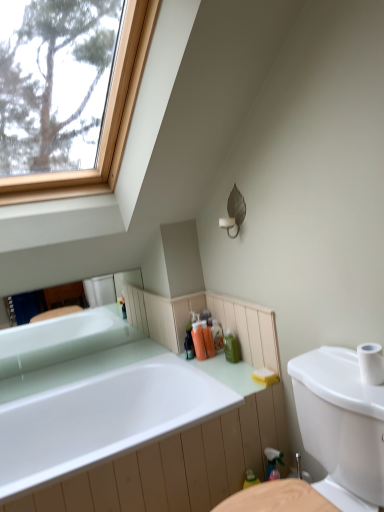
Question: Is white glossy bathtub at upper left, placed as the first bathtub when sorted from top to bottom, in front of white glossy sink at center?

Choices:
 (A) yes
 (B) no

Answer: (B)

Question: Is white glossy bathtub at upper left, which appears as the second bathtub when ordered from the bottom, smaller than white glossy sink at center?

Choices:
 (A) no
 (B) yes

Answer: (B)

Question: Does white glossy bathtub at upper left, which appears as the second bathtub when ordered from the bottom, have a greater height compared to white glossy sink at center?

Choices:
 (A) no
 (B) yes

Answer: (A)

Question: Considering the relative sizes of white glossy bathtub at upper left, which appears as the second bathtub when ordered from the bottom, and white glossy sink at center in the image provided, is white glossy bathtub at upper left, which appears as the second bathtub when ordered from the bottom, bigger than white glossy sink at center?

Choices:
 (A) yes
 (B) no

Answer: (B)

Question: From a real-world perspective, is white glossy bathtub at upper left, placed as the first bathtub when sorted from top to bottom, under white glossy sink at center?

Choices:
 (A) no
 (B) yes

Answer: (A)

Question: Is white glossy sink at center completely or partially inside white glossy bathtub at upper left, which appears as the second bathtub when ordered from the bottom?

Choices:
 (A) yes
 (B) no

Answer: (B)

Question: From the image's perspective, would you say white glossy sink at center is shown under translucent orange soap at center, arranged as the second toiletry when viewed from the left?

Choices:
 (A) no
 (B) yes

Answer: (B)

Question: Is white glossy sink at center shorter than translucent orange soap at center, positioned as the 3th toiletry in right-to-left order?

Choices:
 (A) no
 (B) yes

Answer: (A)

Question: Can you confirm if white glossy sink at center is wider than translucent orange soap at center, arranged as the second toiletry when viewed from the left?

Choices:
 (A) yes
 (B) no

Answer: (A)

Question: Is translucent orange soap at center, positioned as the 3th toiletry in right-to-left order, completely or partially inside white glossy sink at center?

Choices:
 (A) no
 (B) yes

Answer: (A)

Question: Is white glossy sink at center far away from translucent orange soap at center, arranged as the second toiletry when viewed from the left?

Choices:
 (A) yes
 (B) no

Answer: (B)

Question: Does white glossy sink at center have a lesser width compared to translucent orange soap at center, positioned as the 3th toiletry in right-to-left order?

Choices:
 (A) no
 (B) yes

Answer: (A)

Question: Considering the relative sizes of white matte toilet paper at right and white glossy bathtub at upper left, which appears as the second bathtub when ordered from the bottom, in the image provided, is white matte toilet paper at right shorter than white glossy bathtub at upper left, which appears as the second bathtub when ordered from the bottom,?

Choices:
 (A) yes
 (B) no

Answer: (A)